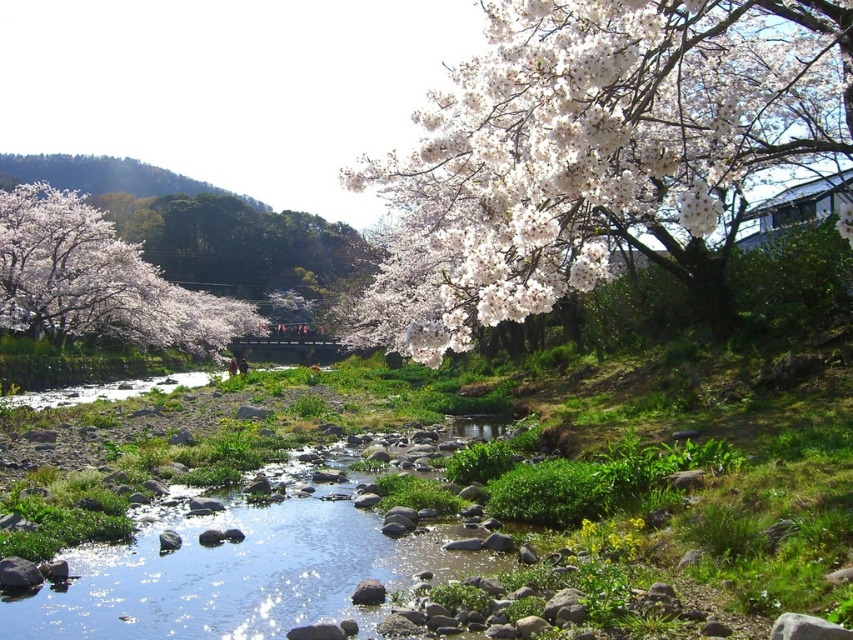
You need to cross the stream but want to avoid getting your shoes wet. The clear water at center and white matte blossoms at left are in your path. Which path should you take to stay dry?

You should take the path near the white matte blossoms at left because the clear water at center is narrower, making it harder to avoid stepping into the water. The white matte blossoms at left area is wider, providing a safer dry path.

You are a photographer standing at the edge of the stream. You want to capture a photo that includes both the white matte flower at upper right and the white matte blossoms at left. Which one should you adjust your camera angle to focus on first to ensure both are in the frame?

The white matte flower at upper right is located above the white matte blossoms at left. To include both in the frame, you should first focus on the white matte flower at upper right to ensure the camera angle captures its higher position while still including the lower positioned white matte blossoms at left.